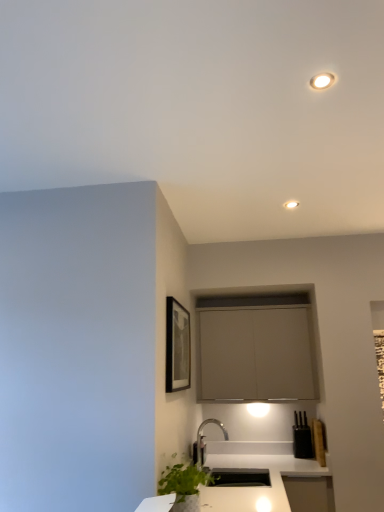
This screenshot has width=384, height=512. I want to click on free location to the right of matte white recessed light at upper center, so click(x=327, y=200).